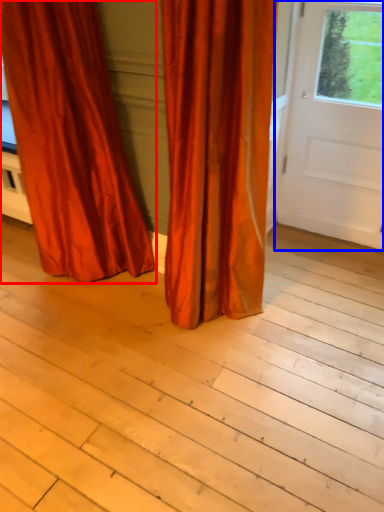
Question: Which of the following is the farthest to the observer, curtain (highlighted by a red box) or door (highlighted by a blue box)?

Choices:
 (A) curtain
 (B) door

Answer: (B)